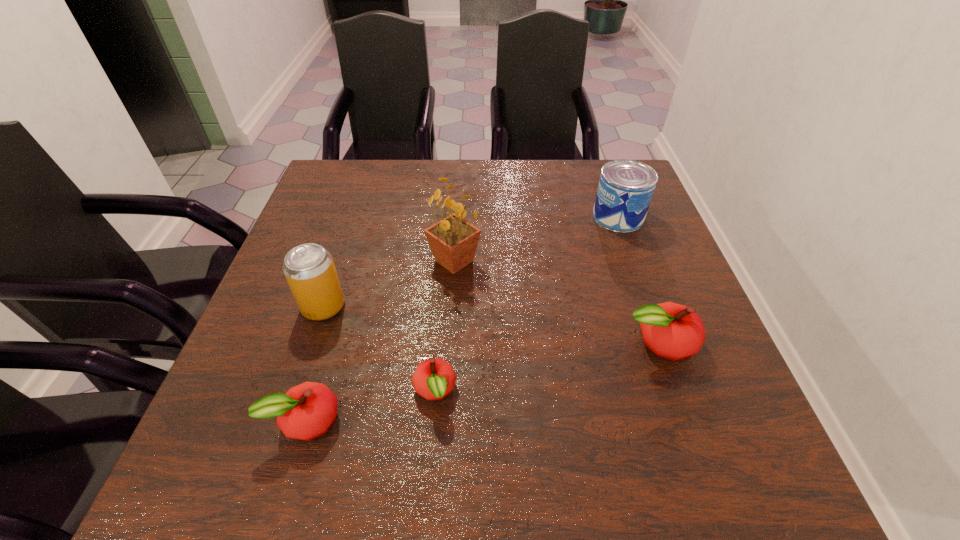
Please point a spot to place another apple for symmetrical spacing. Please provide its 2D coordinates. Your answer should be formatted as a tuple, i.e. [(x, y)], where the tuple contains the x and y coordinates of a point satisfying the conditions above.

[(551, 366)]